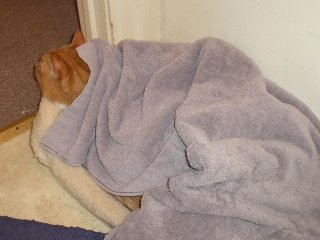
This screenshot has width=320, height=240. What are the coordinates of `blanket` in the screenshot? It's located at [x=160, y=102].